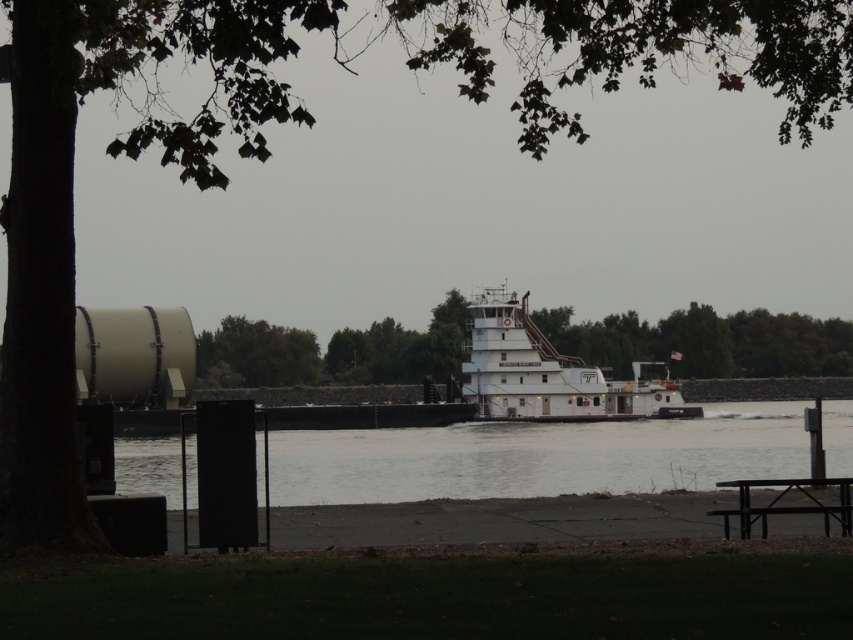
You are standing on the picnic table on the right side of the paved area. You see a point marked at coordinates [537,456]. What is the direction you need to look to see clear water at center?

The point at coordinates [537,456] marks clear water at center, so you need to look towards the center of the image from the picnic table on the right side of the paved area.

You are standing at the riverside and want to take a photo of the white matte tugboat at center without the black metal picnic table at lower right appearing in the shot. How should you adjust your position?

Move your position to the left side of the scene to avoid the black metal picnic table at lower right blocking the view of the white matte tugboat at center.

Based on the photo, you are standing at the picnic table on the right side of the riverside scene. You see two points marked as point 1 at coordinates point (648, 385) and point 2 at coordinates point (805, 492). Which point is closer to you?

Point 1 at coordinates point (648, 385) is closer to you because it is further to the camera than point 2 at coordinates point (805, 492).